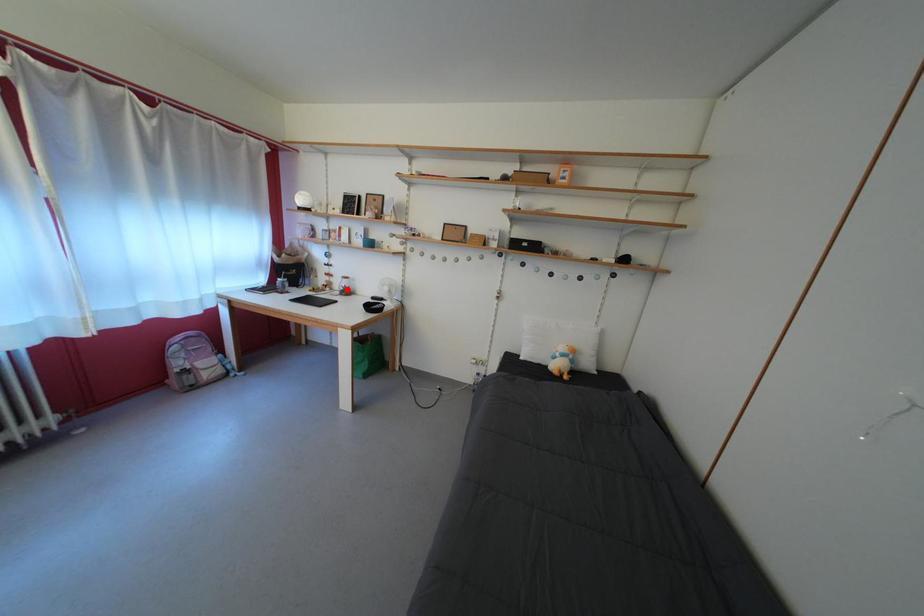
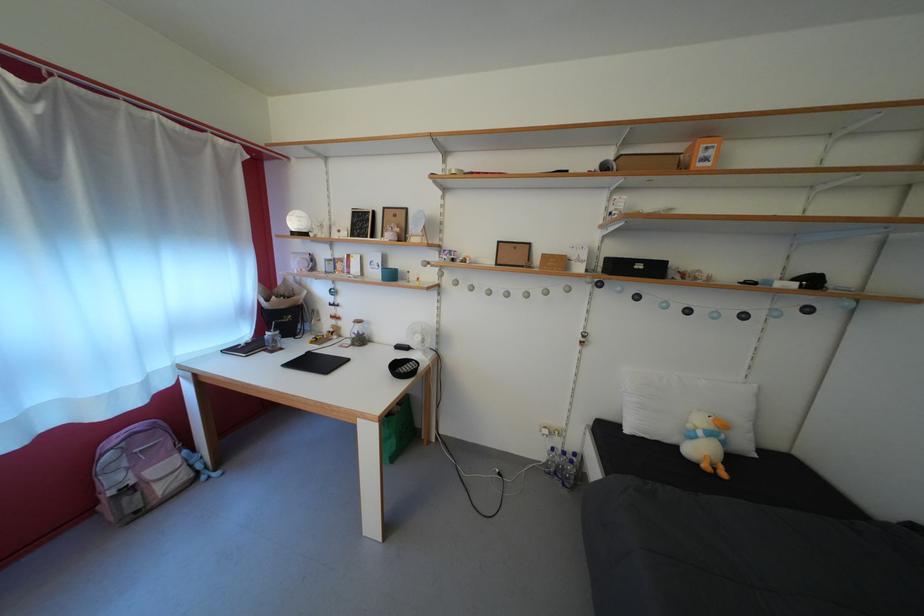
Question: I am providing you with two images of the same scene from different viewpoints. A red point is marked on the first image. Is the red point's position out of view in image 2?

Choices:
 (A) Yes
 (B) No

Answer: (B)